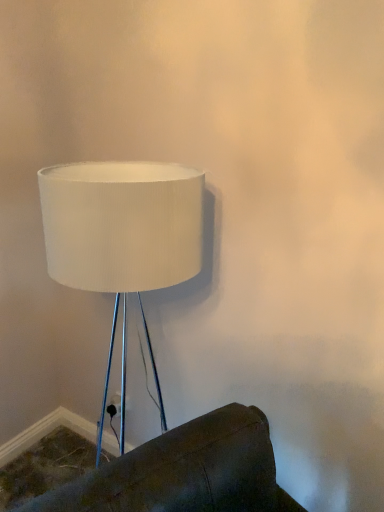
This screenshot has height=512, width=384. Describe the element at coordinates (122, 238) in the screenshot. I see `white fabric lamp at center` at that location.

Identify the location of white fabric lamp at center. The width and height of the screenshot is (384, 512). point(122,238).

Find the location of a particular element. The width and height of the screenshot is (384, 512). white fabric lamp at center is located at coordinates (122, 238).